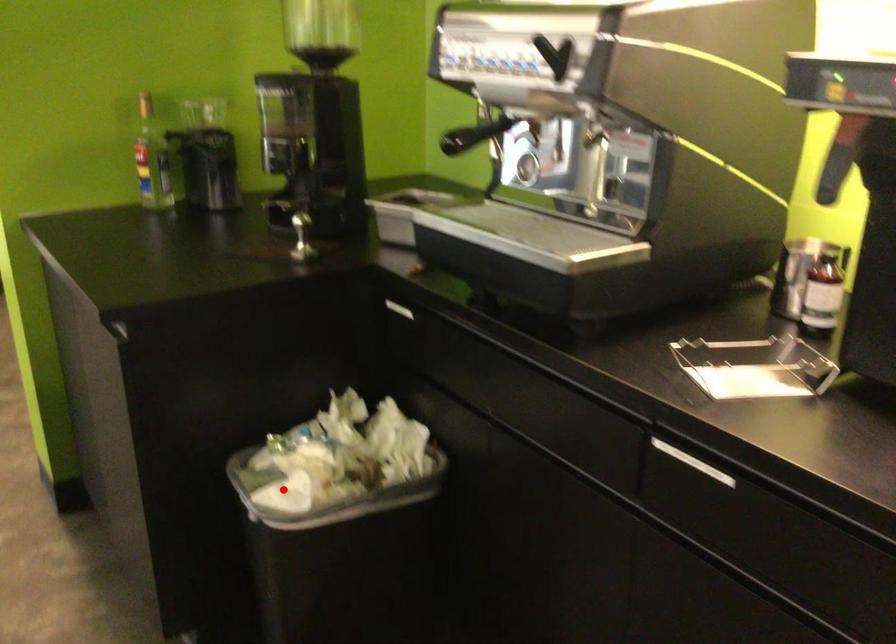
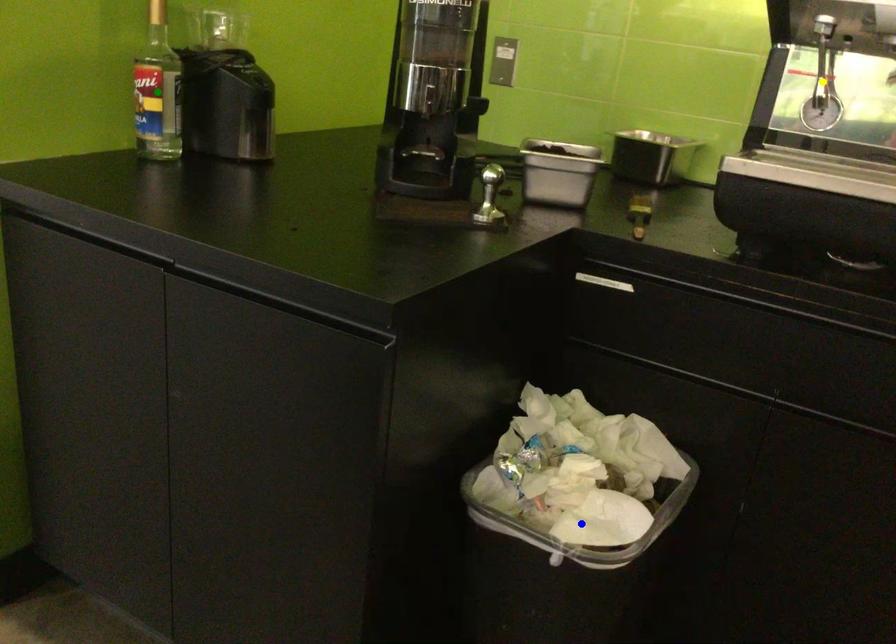
Question: I am providing you with two images of the same scene from different viewpoints. A red point is marked on the first image. You are given multiple points on the second image. In image 2, which mark is for the same physical point as the one in image 1?

Choices:
 (A) green point
 (B) yellow point
 (C) blue point

Answer: (C)